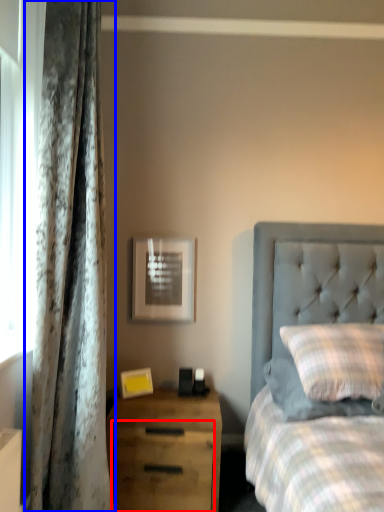
Question: Which object is further to the camera taking this photo, drawer (highlighted by a red box) or curtain (highlighted by a blue box)?

Choices:
 (A) drawer
 (B) curtain

Answer: (A)